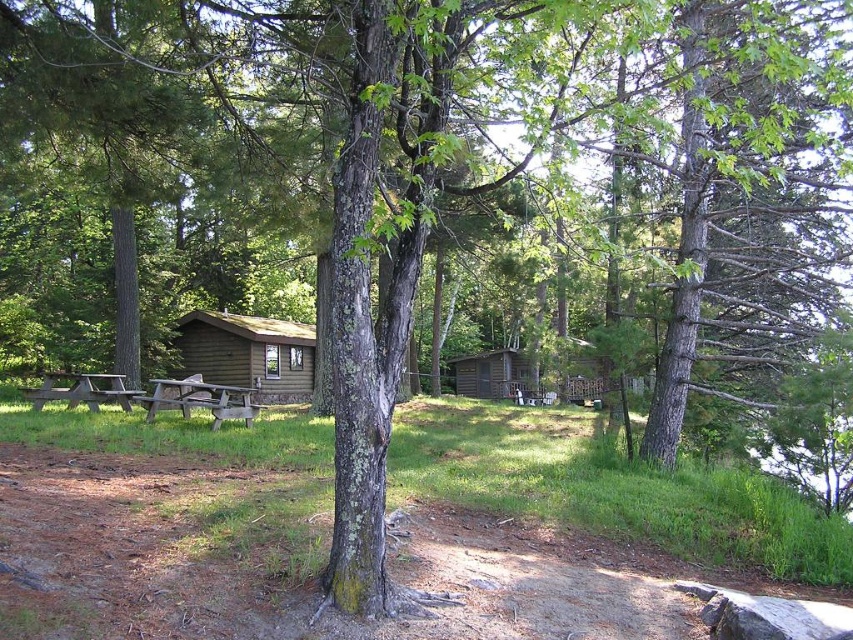
You are standing at the center of the dirt path and see both the wooden picnic table at lower left and the brown wooden picnic table at left. Which picnic table is positioned more to the left side of the scene?

The brown wooden picnic table at left is positioned more to the left side of the scene because the wooden picnic table at lower left is to the right of it.

You are a hiker who just arrived at the campsite. You need to go from the brown wooden picnic table at left to the wooden cabin at center. Which direction should you head?

The wooden cabin at center is to the right of the brown wooden picnic table at left, so you should head to the right.